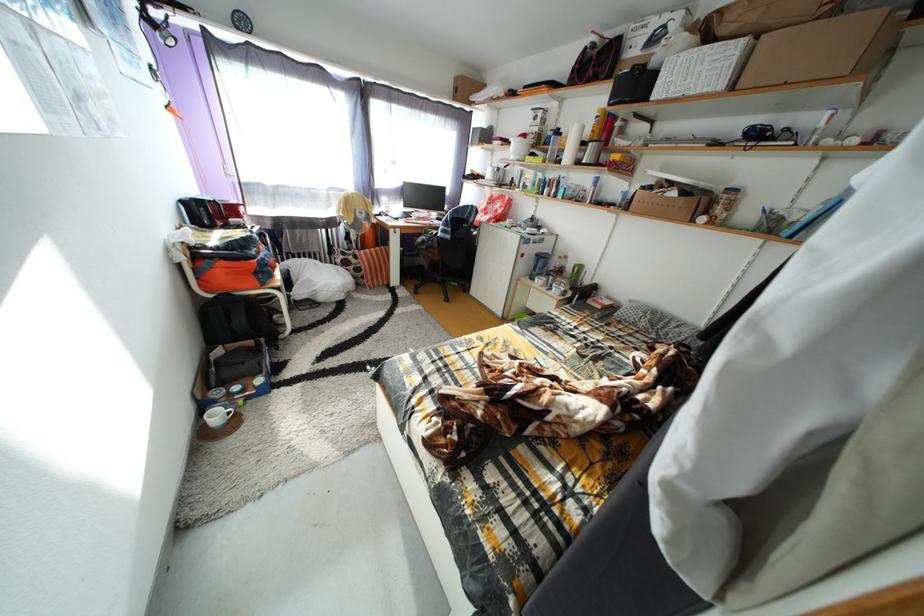
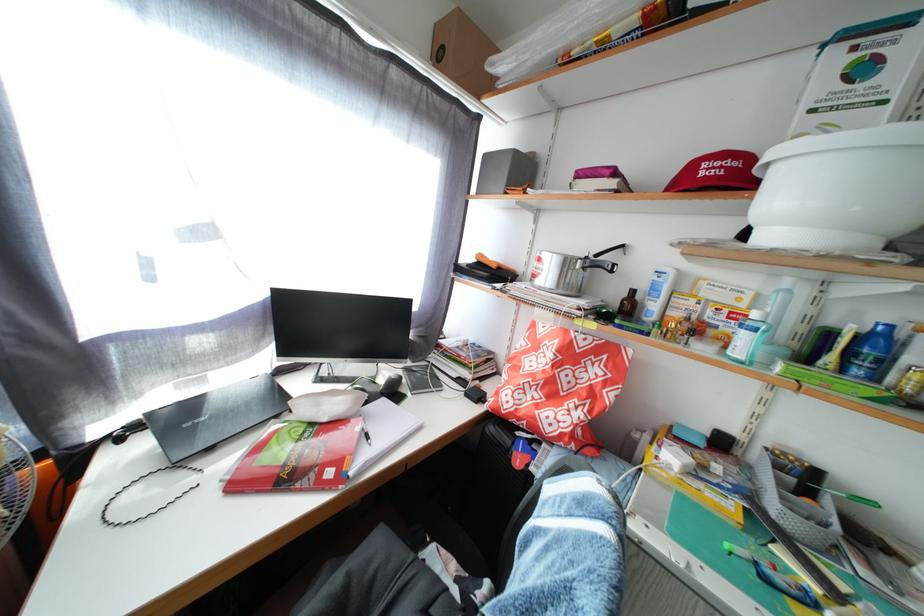
Find the pixel in the second image that matches the point at 517,187 in the first image.

(621, 301)